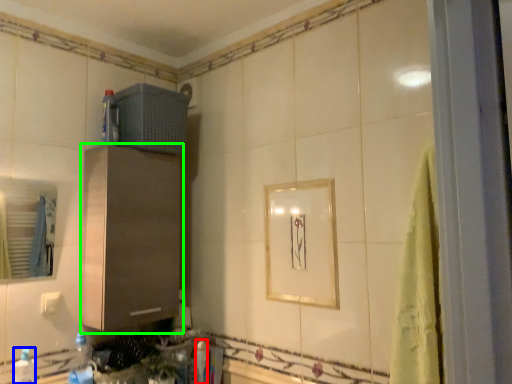
Question: Based on their relative distances, which object is nearer to bottle (highlighted by a red box)? Choose from bottle (highlighted by a blue box) and cabinetry (highlighted by a green box).

Choices:
 (A) bottle
 (B) cabinetry

Answer: (B)